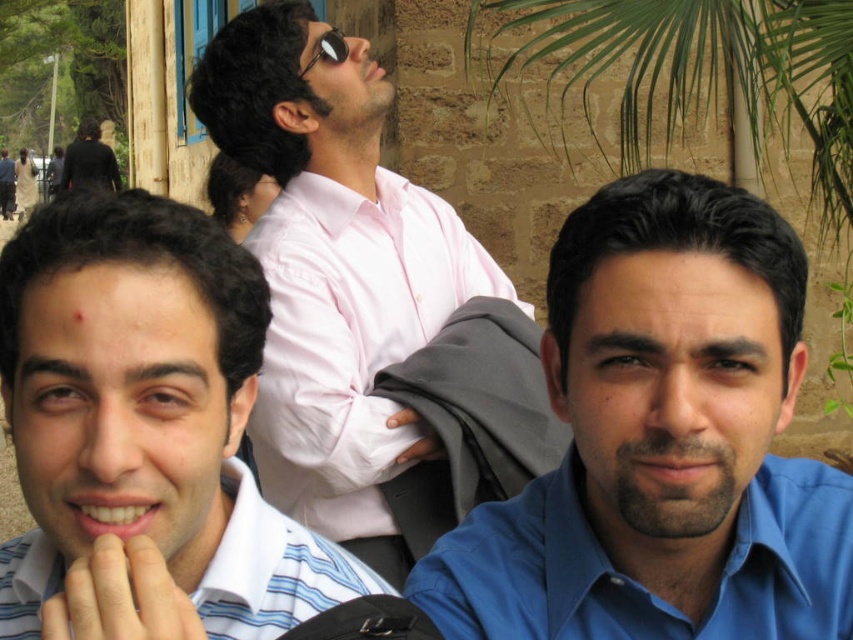
Question: Observing the image, what is the correct spatial positioning of blue smooth shirt at center in reference to pink shirt at upper center?

Choices:
 (A) above
 (B) below

Answer: (A)

Question: Among these objects, which one is farthest from the camera?

Choices:
 (A) blue smooth shirt at center
 (B) black matte jacket at upper left
 (C) pink shirt at upper center

Answer: (B)

Question: Where is pink shirt at upper center located in relation to pink shirt at center in the image?

Choices:
 (A) right
 (B) left

Answer: (B)

Question: Estimate the real-world distances between objects in this image. Which object is farther from the blue smooth shirt at center?

Choices:
 (A) pink shirt at upper center
 (B) black matte jacket at upper left

Answer: (B)

Question: Is blue smooth shirt at center closer to camera compared to black matte jacket at upper left?

Choices:
 (A) no
 (B) yes

Answer: (B)

Question: Estimate the real-world distances between objects in this image. Which object is farther from the black matte jacket at upper left?

Choices:
 (A) pink shirt at center
 (B) pink shirt at upper center

Answer: (A)